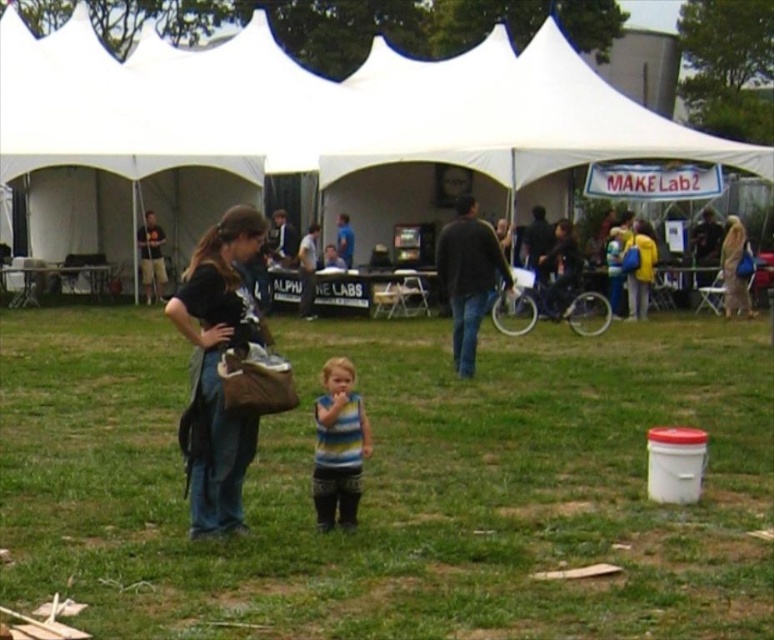
Question: Is white fabric tent at center below denim jacket at center?

Choices:
 (A) yes
 (B) no

Answer: (B)

Question: Based on their relative distances, which object is farther from the striped fabric shirt at center?

Choices:
 (A) light beige fabric bag at right
 (B) matte black shirt at center

Answer: (B)

Question: Among these objects, which one is farthest from the camera?

Choices:
 (A) white fabric tent at center
 (B) striped fabric shirt at center
 (C) green grass at center
 (D) denim jacket at center

Answer: (A)

Question: Is green grass at center to the right of striped fabric shirt at center from the viewer's perspective?

Choices:
 (A) no
 (B) yes

Answer: (A)

Question: Which of the following is the closest to the observer?

Choices:
 (A) white fabric tent at center
 (B) striped fabric shirt at center

Answer: (B)

Question: Where is striped fabric shirt at center located in relation to matte black shirt at center in the image?

Choices:
 (A) above
 (B) below

Answer: (B)